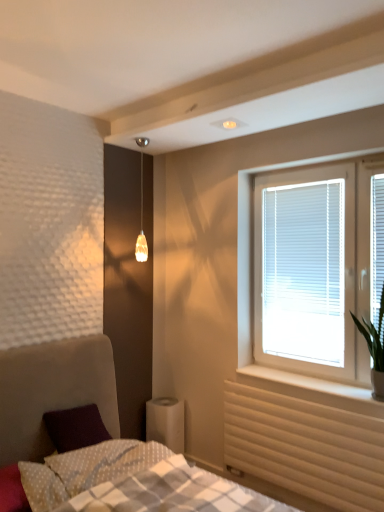
You are a GUI agent. You are given a task and a screenshot of the screen. Output one action in this format:
    pyautogui.click(x=<x>, y=<y>)
    Task: Click on the empty space that is ontop of beige textured radiator at lower right (from a real-world perspective)
    
    Given the screenshot: What is the action you would take?
    pyautogui.click(x=292, y=394)